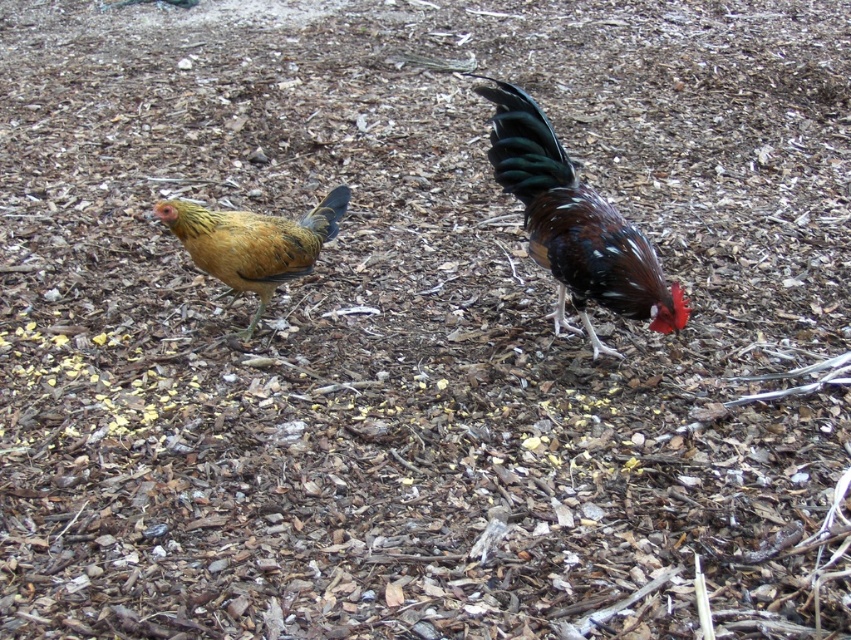
Question: Is the position of shiny brown rooster at right more distant than that of golden-yellow feathers at left?

Choices:
 (A) yes
 (B) no

Answer: (B)

Question: Which point is farther from the camera taking this photo?

Choices:
 (A) (267, 266)
 (B) (610, 268)

Answer: (A)

Question: Which point appears closest to the camera in this image?

Choices:
 (A) (506, 188)
 (B) (198, 214)

Answer: (A)

Question: Where is shiny brown rooster at right located in relation to golden-yellow feathers at left in the image?

Choices:
 (A) left
 (B) right

Answer: (B)

Question: Does shiny brown rooster at right have a smaller size compared to golden-yellow feathers at left?

Choices:
 (A) yes
 (B) no

Answer: (B)